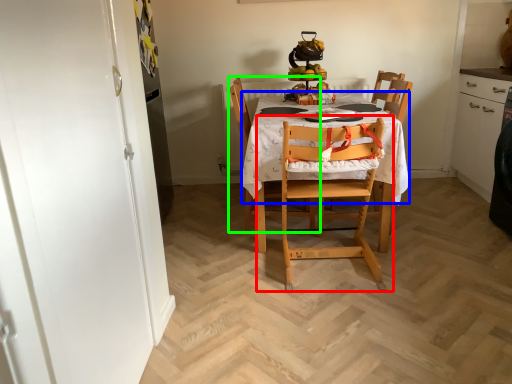
Question: Considering the real-world distances, which object is farthest from chair (highlighted by a red box)? tablecloth (highlighted by a blue box) or chair (highlighted by a green box)?

Choices:
 (A) tablecloth
 (B) chair

Answer: (B)